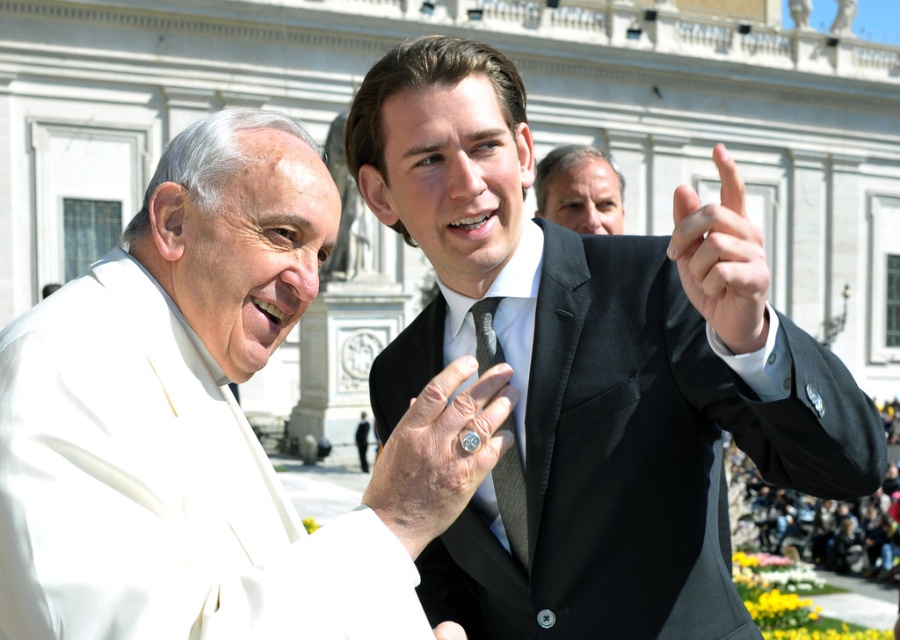
Question: Which point is farther from the camera taking this photo?

Choices:
 (A) (131, 392)
 (B) (726, 269)
 (C) (414, 406)
 (D) (577, 170)

Answer: (D)

Question: Does black satin suit at center appear under silver metallic ring at center?

Choices:
 (A) no
 (B) yes

Answer: (B)

Question: Which point is closer to the camera?

Choices:
 (A) (849, 484)
 (B) (709, 323)

Answer: (B)

Question: Can you confirm if black satin suit at center is positioned below silver metallic ring at center?

Choices:
 (A) yes
 (B) no

Answer: (A)

Question: Is white matte suit at left wider than black silk hand at upper right?

Choices:
 (A) no
 (B) yes

Answer: (B)

Question: Which object appears farthest from the camera in this image?

Choices:
 (A) black silk hand at upper right
 (B) smooth gray suit at upper center
 (C) silver metallic ring at center
 (D) black satin suit at center

Answer: (B)